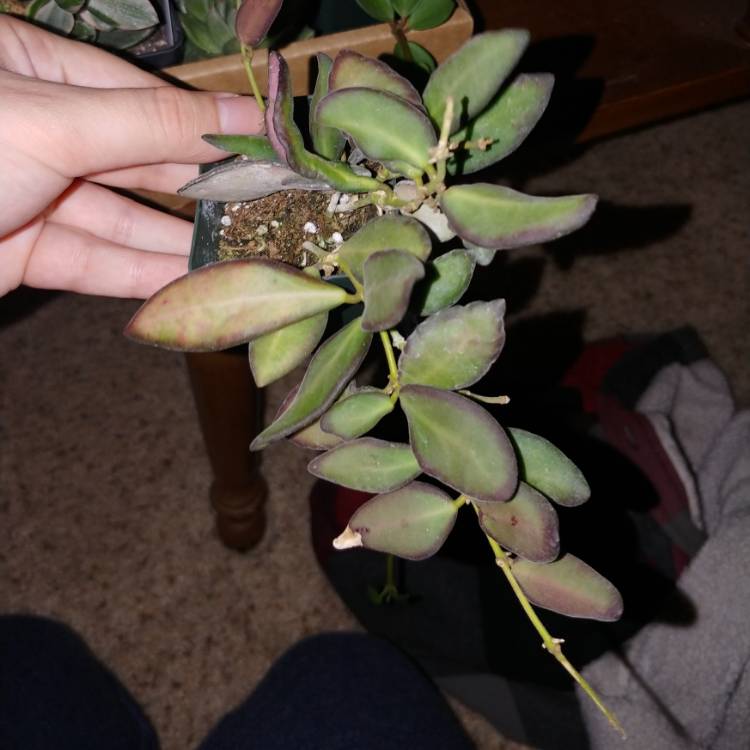
You are a GUI agent. You are given a task and a screenshot of the screen. Output one action in this format:
    pyautogui.click(x=<x>, y=<y>)
    Task: Click on the plant
    The image size is (750, 750).
    Given the screenshot: What is the action you would take?
    pyautogui.click(x=325, y=244)